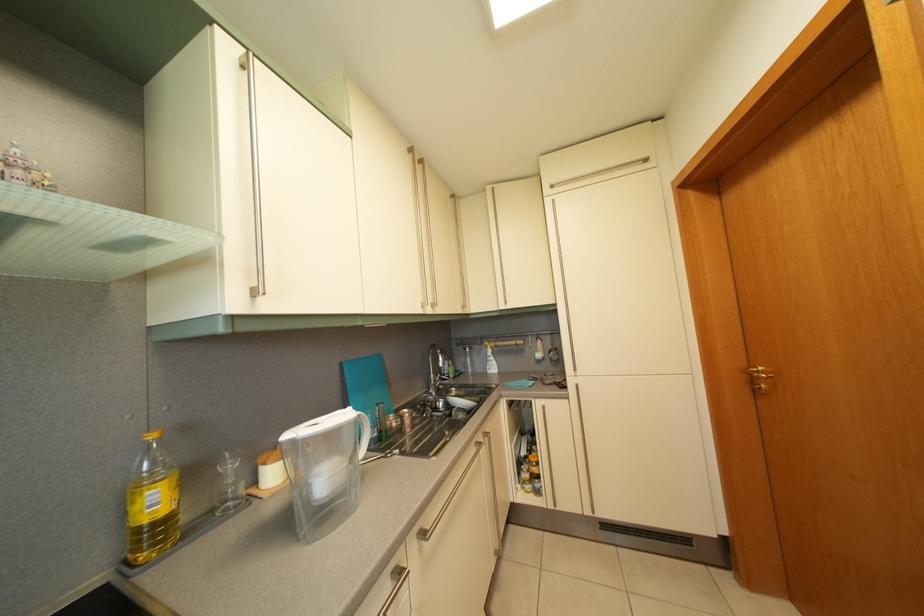
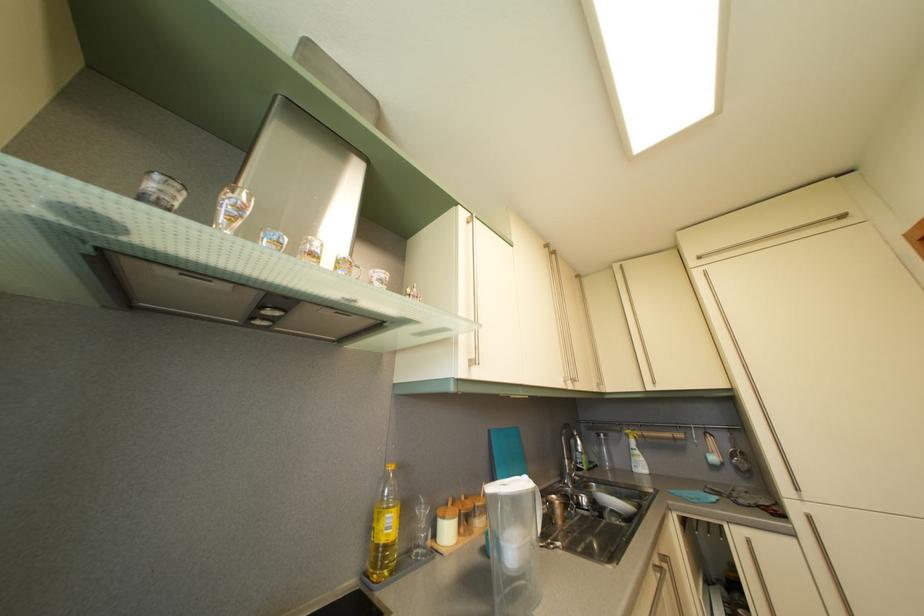
Locate, in the second image, the point that corresponds to (x=560, y=367) in the first image.

(746, 476)